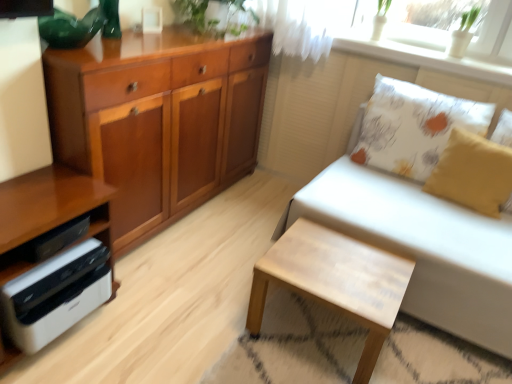
Question: From the image's perspective, is yellow fabric pillow at right, which appears as the 2th pillow when viewed from the back, above or below white glossy printer at lower left?

Choices:
 (A) above
 (B) below

Answer: (A)

Question: In the image, is yellow fabric pillow at right, which appears as the 2th pillow when viewed from the back, on the left side or the right side of white glossy printer at lower left?

Choices:
 (A) right
 (B) left

Answer: (A)

Question: Estimate the real-world distances between objects in this image. Which object is closer to the white textured cushion at upper right?

Choices:
 (A) green leafy plant at upper center
 (B) white fabric couch at right
 (C) wooden cabinet at left
 (D) white leather stool at lower right
 (E) white printed cushion at upper right, the second pillow viewed from the front

Answer: (E)

Question: Which is nearer to the white textured cushion at upper right?

Choices:
 (A) yellow fabric pillow at right, the first pillow from the front
 (B) white printed cushion at upper right, the second pillow viewed from the front
 (C) wooden cabinet at left
 (D) white leather stool at lower right
 (E) white fabric couch at right

Answer: (B)